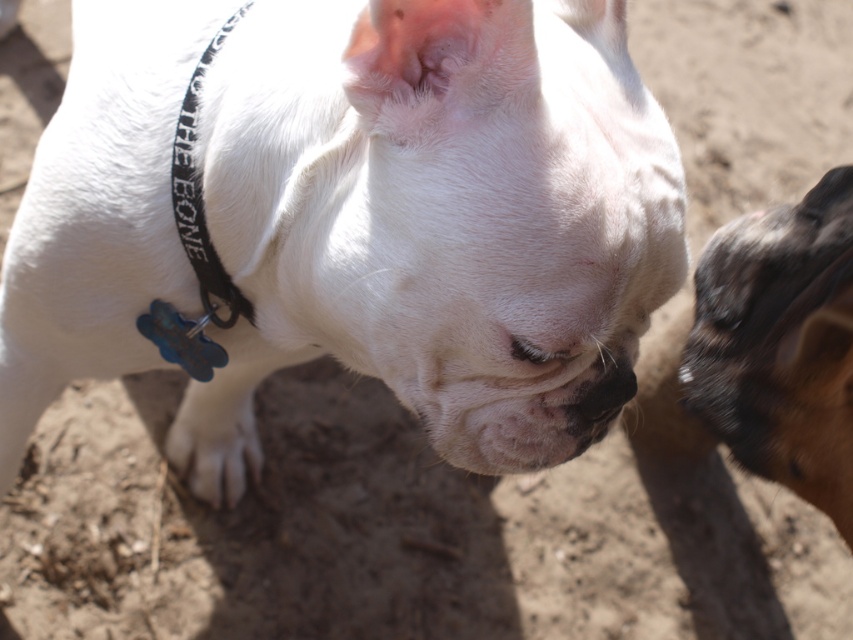
Question: From the image, what is the correct spatial relationship of white fur paw at lower center in relation to black fabric neckband at left?

Choices:
 (A) below
 (B) above

Answer: (A)

Question: Is white fur paw at lower center bigger than black fabric neckband at left?

Choices:
 (A) no
 (B) yes

Answer: (B)

Question: Is white matte dog at center wider than black fabric neckband at left?

Choices:
 (A) yes
 (B) no

Answer: (A)

Question: Which point is closer to the camera?

Choices:
 (A) white matte dog at center
 (B) white fur paw at lower center
 (C) brown fur at right
 (D) black fabric neckband at left

Answer: (A)

Question: Which object appears farthest from the camera in this image?

Choices:
 (A) white fur paw at lower center
 (B) white matte dog at center
 (C) black fabric neckband at left
 (D) brown fur at right

Answer: (A)

Question: Which point is farther to the camera?

Choices:
 (A) brown fur at right
 (B) black fabric neckband at left
 (C) white matte dog at center
 (D) white fur paw at lower center

Answer: (D)